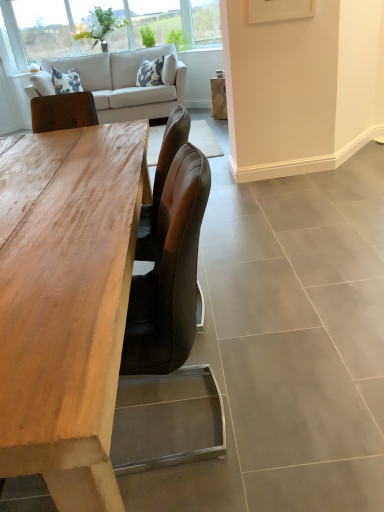
You are a GUI agent. You are given a task and a screenshot of the screen. Output one action in this format:
    pyautogui.click(x=<x>, y=<y>)
    Task: Click on the wooden table at center
    
    Given the screenshot: What is the action you would take?
    (x=67, y=303)

This screenshot has height=512, width=384. What do you see at coordinates (11, 38) in the screenshot?
I see `clear glass window at upper left` at bounding box center [11, 38].

Identify the location of wooden table at center. (67, 303).

Is light beige fabric couch at upper left at the back of wooden table at center?

Yes.

Is point (25, 330) farther from viewer compared to point (158, 95)?

No, it is in front of (158, 95).

Visually, is wooden table at center positioned to the left or to the right of light beige fabric couch at upper left?

In the image, wooden table at center appears on the right side of light beige fabric couch at upper left.

Which of these two, wooden table at center or light beige fabric couch at upper left, stands taller?

With more height is light beige fabric couch at upper left.

Who is bigger, clear glass window at upper left or light beige fabric couch at upper left?

light beige fabric couch at upper left is bigger.

Which object is thinner, clear glass window at upper left or light beige fabric couch at upper left?

clear glass window at upper left.

Is clear glass window at upper left to the left or to the right of light beige fabric couch at upper left in the image?

From the image, it's evident that clear glass window at upper left is to the left of light beige fabric couch at upper left.

Is point (50, 13) closer or farther from the camera than point (20, 376)?

Point (50, 13) is farther from the camera than point (20, 376).

Considering the positions of objects clear glass window at upper left and wooden table at center in the image provided, who is more to the left, clear glass window at upper left or wooden table at center?

clear glass window at upper left is more to the left.

In the scene shown: Which of these two, clear glass window at upper left or wooden table at center, is bigger?

wooden table at center is bigger.

Who is shorter, clear glass window at upper left or wooden table at center?

With less height is wooden table at center.

Is point (55, 401) behind point (10, 11)?

No, it is in front of (10, 11).

Does wooden table at center have a greater width compared to clear glass window at upper left?

Indeed, wooden table at center has a greater width compared to clear glass window at upper left.

Is wooden table at center turned away from clear glass window at upper left?

Correct, wooden table at center is looking away from clear glass window at upper left.

Would you consider wooden table at center to be distant from clear glass window at upper left?

Yes, wooden table at center and clear glass window at upper left are quite far apart.

Is the depth of light beige fabric couch at upper left less than that of clear glass window at upper left?

Yes, the depth of light beige fabric couch at upper left is less than that of clear glass window at upper left.

Is clear glass window at upper left inside light beige fabric couch at upper left?

No, clear glass window at upper left is not surrounded by light beige fabric couch at upper left.

From the image's perspective, which is above, light beige fabric couch at upper left or clear glass window at upper left?

clear glass window at upper left appears higher in the image.

Could you tell me if light beige fabric couch at upper left is turned towards wooden table at center?

Yes, light beige fabric couch at upper left is aimed at wooden table at center.

From the picture: How different are the orientations of light beige fabric couch at upper left and wooden table at center in degrees?

They differ by 0.309 degrees in their facing directions.

Does light beige fabric couch at upper left have a greater height compared to wooden table at center?

Correct, light beige fabric couch at upper left is much taller as wooden table at center.

Based on the photo, from a real-world perspective, is light beige fabric couch at upper left above or below wooden table at center?

light beige fabric couch at upper left is above wooden table at center.

Where is `desk below the light beige fabric couch at upper left (from the image's perspective)`? This screenshot has width=384, height=512. desk below the light beige fabric couch at upper left (from the image's perspective) is located at coordinates (67, 303).

The width and height of the screenshot is (384, 512). In order to click on studio couch that appears on the right of clear glass window at upper left in this screenshot , I will do `click(126, 84)`.

Based on their spatial positions, is clear glass window at upper left or wooden table at center further from light beige fabric couch at upper left?

Based on the image, wooden table at center appears to be further to light beige fabric couch at upper left.

When comparing their distances from wooden table at center, does clear glass window at upper left or light beige fabric couch at upper left seem further?

clear glass window at upper left lies further to wooden table at center than the other object.

Estimate the real-world distances between objects in this image. Which object is closer to wooden table at center, light beige fabric couch at upper left or clear glass window at upper left?

light beige fabric couch at upper left is positioned closer to the anchor wooden table at center.

Estimate the real-world distances between objects in this image. Which object is further from clear glass window at upper left, light beige fabric couch at upper left or wooden table at center?

wooden table at center lies further to clear glass window at upper left than the other object.

Based on their spatial positions, is wooden table at center or light beige fabric couch at upper left further from clear glass window at upper left?

Among the two, wooden table at center is located further to clear glass window at upper left.

Looking at this image, which object lies nearer to the anchor point light beige fabric couch at upper left, wooden table at center or clear glass window at upper left?

clear glass window at upper left.

Locate an element on the screen. This screenshot has height=512, width=384. studio couch located between wooden table at center and clear glass window at upper left in the depth direction is located at coordinates (126, 84).